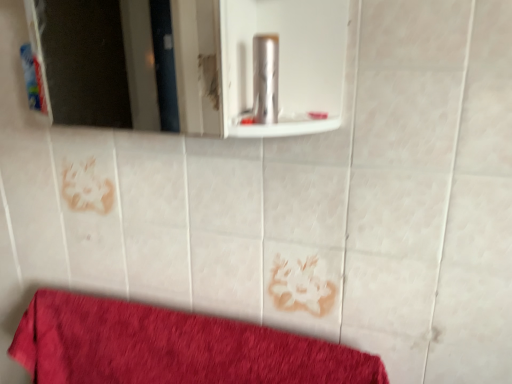
What do you see at coordinates (33, 79) in the screenshot?
I see `blue plastic toothpaste tube at left, which ranks as the second toiletry in right-to-left order` at bounding box center [33, 79].

This screenshot has width=512, height=384. Identify the location of red cotton towel at lower left. (170, 347).

Where is `blue plastic toothpaste tube at left, marked as the first toiletry in a left-to-right arrangement`? The height and width of the screenshot is (384, 512). blue plastic toothpaste tube at left, marked as the first toiletry in a left-to-right arrangement is located at coordinates (33, 79).

Locate an element on the screen. towel lying below the blue plastic toothpaste tube at left, which ranks as the 2th toiletry in front-to-back order (from the image's perspective) is located at coordinates coord(170,347).

Can you tell me how much blue plastic toothpaste tube at left, which ranks as the second toiletry in right-to-left order, and red cotton towel at lower left differ in facing direction?

There is a 2.03-degree angle between the facing directions of blue plastic toothpaste tube at left, which ranks as the second toiletry in right-to-left order, and red cotton towel at lower left.

In terms of height, does blue plastic toothpaste tube at left, which ranks as the second toiletry in right-to-left order, look taller or shorter compared to red cotton towel at lower left?

Considering their sizes, blue plastic toothpaste tube at left, which ranks as the second toiletry in right-to-left order, has less height than red cotton towel at lower left.

Between white glossy mirror at upper center and metallic silver canister at center, the 1th toiletry when ordered from front to back, which one is positioned behind?

metallic silver canister at center, the 1th toiletry when ordered from front to back, is more distant.

Which object is positioned more to the right, white glossy mirror at upper center or metallic silver canister at center, which is the 1th toiletry from right to left?

metallic silver canister at center, which is the 1th toiletry from right to left.

Are white glossy mirror at upper center and metallic silver canister at center, which is the 1th toiletry from right to left, located far from each other?

white glossy mirror at upper center is far away from metallic silver canister at center, which is the 1th toiletry from right to left.

Is point (305, 46) less distant than point (255, 109)?

No, (305, 46) is further to viewer.

Is metallic silver canister at center, acting as the second toiletry starting from the left, far away from white glossy mirror at upper center?

Answer: Yes.

Is metallic silver canister at center, placed as the 2th toiletry when sorted from back to front, positioned beyond the bounds of white glossy mirror at upper center?

No, metallic silver canister at center, placed as the 2th toiletry when sorted from back to front, is not outside of white glossy mirror at upper center.

Between metallic silver canister at center, which is the 1th toiletry from right to left, and white glossy mirror at upper center, which one has larger width?

white glossy mirror at upper center.

Considering the relative sizes of red cotton towel at lower left and metallic silver canister at center, the 1th toiletry when ordered from front to back, in the image provided, is red cotton towel at lower left thinner than metallic silver canister at center, the 1th toiletry when ordered from front to back,?

No, red cotton towel at lower left is not thinner than metallic silver canister at center, the 1th toiletry when ordered from front to back.

Which is in front, red cotton towel at lower left or metallic silver canister at center, which is the 1th toiletry from right to left?

metallic silver canister at center, which is the 1th toiletry from right to left, is in front.

Which is in front, point (341, 383) or point (264, 119)?

The point (264, 119) is in front.

Measure the distance between red cotton towel at lower left and metallic silver canister at center, which is the 1th toiletry from right to left.

red cotton towel at lower left and metallic silver canister at center, which is the 1th toiletry from right to left, are 21.65 inches apart from each other.

Identify the location of toiletry on the left of metallic silver canister at center, which is the 1th toiletry from right to left. This screenshot has width=512, height=384. (33, 79).

Consider the image. Is metallic silver canister at center, acting as the second toiletry starting from the left, at the right side of blue plastic toothpaste tube at left, the first toiletry viewed from the back?

Yes, metallic silver canister at center, acting as the second toiletry starting from the left, is to the right of blue plastic toothpaste tube at left, the first toiletry viewed from the back.

From a real-world perspective, who is located lower, metallic silver canister at center, placed as the 2th toiletry when sorted from back to front, or blue plastic toothpaste tube at left, which ranks as the 2th toiletry in front-to-back order?

In real-world perspective, blue plastic toothpaste tube at left, which ranks as the 2th toiletry in front-to-back order, is lower.

Is metallic silver canister at center, acting as the second toiletry starting from the left, not within blue plastic toothpaste tube at left, which ranks as the 2th toiletry in front-to-back order?

That's correct, metallic silver canister at center, acting as the second toiletry starting from the left, is outside of blue plastic toothpaste tube at left, which ranks as the 2th toiletry in front-to-back order.

From a real-world perspective, is white glossy mirror at upper center over red cotton towel at lower left?

Indeed, from a real-world perspective, white glossy mirror at upper center stands above red cotton towel at lower left.

Considering the sizes of white glossy mirror at upper center and red cotton towel at lower left in the image, is white glossy mirror at upper center wider or thinner than red cotton towel at lower left?

Clearly, white glossy mirror at upper center has more width compared to red cotton towel at lower left.

How different are the orientations of white glossy mirror at upper center and red cotton towel at lower left in degrees?

They differ by 2.03 degrees in their facing directions.

Based on the photo, considering the positions of objects white glossy mirror at upper center and red cotton towel at lower left in the image provided, who is in front, white glossy mirror at upper center or red cotton towel at lower left?

white glossy mirror at upper center is closer to the camera.

Is red cotton towel at lower left positioned before white glossy mirror at upper center?

No, red cotton towel at lower left is behind white glossy mirror at upper center.

Is white glossy mirror at upper center inside red cotton towel at lower left?

No, white glossy mirror at upper center is not surrounded by red cotton towel at lower left.

Image resolution: width=512 pixels, height=384 pixels. Find the location of `towel on the right side of white glossy mirror at upper center`. towel on the right side of white glossy mirror at upper center is located at coordinates (170, 347).

From a real-world perspective, is red cotton towel at lower left over white glossy mirror at upper center?

No, from a real-world perspective, red cotton towel at lower left is not above white glossy mirror at upper center.

At what (x,y) coordinates should I click in order to perform the action: click on towel on the right side of blue plastic toothpaste tube at left, which ranks as the second toiletry in right-to-left order. Please return your answer as a coordinate pair (x, y). This screenshot has width=512, height=384. Looking at the image, I should click on (170, 347).

This screenshot has width=512, height=384. What are the coordinates of `mirror that is above the metallic silver canister at center, acting as the second toiletry starting from the left (from the image's perspective)` in the screenshot? It's located at (256, 65).

When comparing their distances from red cotton towel at lower left, does white glossy mirror at upper center or metallic silver canister at center, acting as the second toiletry starting from the left, seem closer?

metallic silver canister at center, acting as the second toiletry starting from the left.

Consider the image. When comparing their distances from red cotton towel at lower left, does metallic silver canister at center, acting as the second toiletry starting from the left, or blue plastic toothpaste tube at left, which ranks as the second toiletry in right-to-left order, seem further?

metallic silver canister at center, acting as the second toiletry starting from the left, is further to red cotton towel at lower left.

Considering their positions, is blue plastic toothpaste tube at left, marked as the first toiletry in a left-to-right arrangement, positioned closer to white glossy mirror at upper center than metallic silver canister at center, acting as the second toiletry starting from the left?

Based on the image, blue plastic toothpaste tube at left, marked as the first toiletry in a left-to-right arrangement, appears to be nearer to white glossy mirror at upper center.

When comparing their distances from metallic silver canister at center, placed as the 2th toiletry when sorted from back to front, does blue plastic toothpaste tube at left, which ranks as the 2th toiletry in front-to-back order, or red cotton towel at lower left seem further?

red cotton towel at lower left is further to metallic silver canister at center, placed as the 2th toiletry when sorted from back to front.

Consider the image. Based on their spatial positions, is red cotton towel at lower left or white glossy mirror at upper center further from metallic silver canister at center, acting as the second toiletry starting from the left?

white glossy mirror at upper center is positioned further to the anchor metallic silver canister at center, acting as the second toiletry starting from the left.

Which object lies nearer to the anchor point metallic silver canister at center, the 1th toiletry when ordered from front to back, white glossy mirror at upper center or blue plastic toothpaste tube at left, the first toiletry viewed from the back?

The object closer to metallic silver canister at center, the 1th toiletry when ordered from front to back, is blue plastic toothpaste tube at left, the first toiletry viewed from the back.

Estimate the real-world distances between objects in this image. Which object is closer to white glossy mirror at upper center, red cotton towel at lower left or metallic silver canister at center, which is the 1th toiletry from right to left?

Based on the image, red cotton towel at lower left appears to be nearer to white glossy mirror at upper center.

When comparing their distances from metallic silver canister at center, the 1th toiletry when ordered from front to back, does blue plastic toothpaste tube at left, marked as the first toiletry in a left-to-right arrangement, or white glossy mirror at upper center seem further?

The object further to metallic silver canister at center, the 1th toiletry when ordered from front to back, is white glossy mirror at upper center.

Identify the location of mirror situated between blue plastic toothpaste tube at left, marked as the first toiletry in a left-to-right arrangement, and metallic silver canister at center, the 1th toiletry when ordered from front to back, from left to right. Image resolution: width=512 pixels, height=384 pixels. (256, 65).

Locate an element on the screen. The height and width of the screenshot is (384, 512). mirror between blue plastic toothpaste tube at left, the first toiletry viewed from the back, and red cotton towel at lower left, in the vertical direction is located at coordinates coord(256,65).

You are a GUI agent. You are given a task and a screenshot of the screen. Output one action in this format:
    pyautogui.click(x=<x>, y=<y>)
    Task: Click on the toiletry between blue plastic toothpaste tube at left, which ranks as the second toiletry in right-to-left order, and red cotton towel at lower left in the up-down direction
    The image size is (512, 384).
    Given the screenshot: What is the action you would take?
    pyautogui.click(x=265, y=78)

Locate an element on the screen. toiletry between white glossy mirror at upper center and red cotton towel at lower left vertically is located at coordinates tap(265, 78).